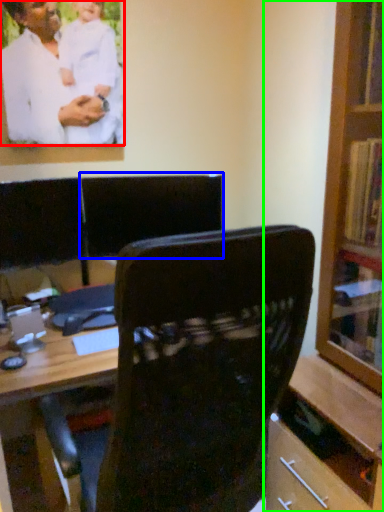
Question: Which object is positioned closest to man (highlighted by a red box)? Select from armchair (highlighted by a blue box) and bookcase (highlighted by a green box).

Choices:
 (A) armchair
 (B) bookcase

Answer: (A)